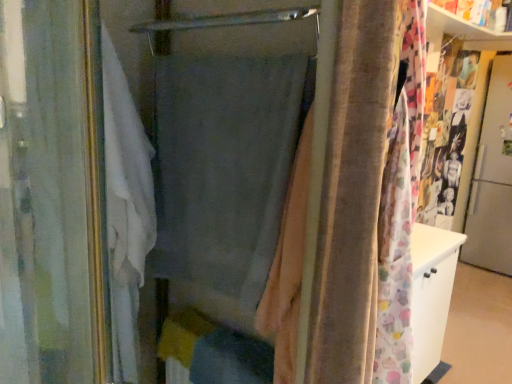
Question: Does metallic silver screen door at right have a larger size compared to gray fabric curtain at center, which appears as the 2th curtain when viewed from the left?

Choices:
 (A) no
 (B) yes

Answer: (B)

Question: From a real-world perspective, is metallic silver screen door at right physically below gray fabric curtain at center, the 1th curtain positioned from the right?

Choices:
 (A) yes
 (B) no

Answer: (A)

Question: Is gray fabric curtain at center, which appears as the 2th curtain when viewed from the left, located within metallic silver screen door at right?

Choices:
 (A) no
 (B) yes

Answer: (A)

Question: Is metallic silver screen door at right shorter than gray fabric curtain at center, the 1th curtain positioned from the right?

Choices:
 (A) no
 (B) yes

Answer: (A)

Question: Is metallic silver screen door at right next to gray fabric curtain at center, which appears as the 2th curtain when viewed from the left?

Choices:
 (A) no
 (B) yes

Answer: (A)

Question: From their relative heights in the image, would you say beige velvety fabric at center is taller or shorter than gray fabric curtain at center, which appears as the 2th curtain when viewed from the left?

Choices:
 (A) short
 (B) tall

Answer: (B)

Question: In the image, is beige velvety fabric at center positioned in front of or behind gray fabric curtain at center, which appears as the 2th curtain when viewed from the left?

Choices:
 (A) front
 (B) behind

Answer: (A)

Question: In terms of size, does beige velvety fabric at center appear bigger or smaller than gray fabric curtain at center, which appears as the 2th curtain when viewed from the left?

Choices:
 (A) big
 (B) small

Answer: (B)

Question: Is point (338, 372) closer or farther from the camera than point (245, 326)?

Choices:
 (A) closer
 (B) farther

Answer: (A)

Question: In the image, is metallic silver screen door at right positioned in front of or behind gray fabric curtain at center, which appears as the 2th curtain when viewed from the left?

Choices:
 (A) front
 (B) behind

Answer: (B)

Question: Considering the positions of metallic silver screen door at right and gray fabric curtain at center, the 1th curtain positioned from the right, in the image, is metallic silver screen door at right bigger or smaller than gray fabric curtain at center, the 1th curtain positioned from the right,?

Choices:
 (A) big
 (B) small

Answer: (A)

Question: Is point (483, 112) positioned closer to the camera than point (264, 64)?

Choices:
 (A) closer
 (B) farther

Answer: (B)

Question: In terms of height, does metallic silver screen door at right look taller or shorter compared to gray fabric curtain at center, which appears as the 2th curtain when viewed from the left?

Choices:
 (A) short
 (B) tall

Answer: (B)

Question: From a real-world perspective, is beige velvety fabric at center above or below metallic silver screen door at right?

Choices:
 (A) below
 (B) above

Answer: (B)

Question: Is point (364, 304) positioned closer to the camera than point (483, 226)?

Choices:
 (A) farther
 (B) closer

Answer: (B)